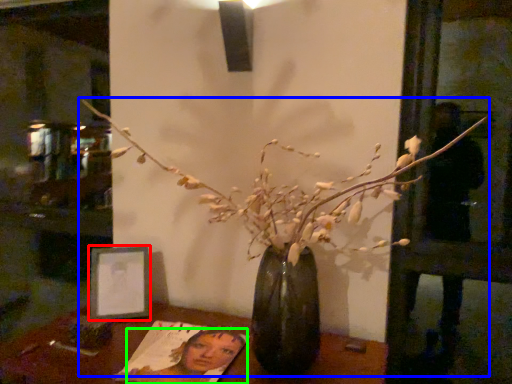
Question: Which object is the closest to the picture frame (highlighted by a red box)? Choose among these: houseplant (highlighted by a blue box) or woman (highlighted by a green box).

Choices:
 (A) houseplant
 (B) woman

Answer: (B)